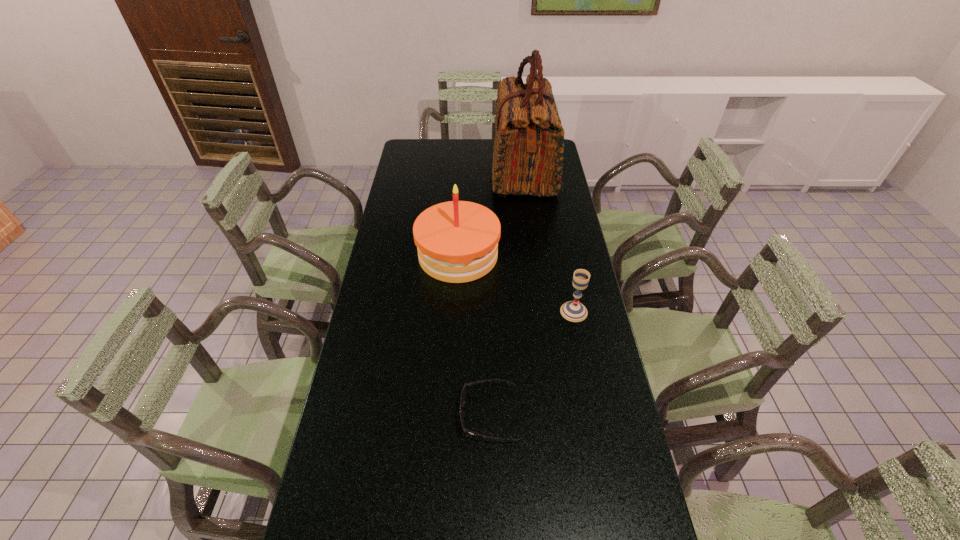
At what (x,y) coordinates should I click in order to perform the action: click on the farthest object. Please return your answer as a coordinate pair (x, y). The height and width of the screenshot is (540, 960). Looking at the image, I should click on (528, 148).

Where is `shopping bag`? The image size is (960, 540). shopping bag is located at coordinates (528, 148).

At what (x,y) coordinates should I click in order to perform the action: click on the second farthest object. Please return your answer as a coordinate pair (x, y). This screenshot has width=960, height=540. Looking at the image, I should click on (457, 241).

The height and width of the screenshot is (540, 960). Identify the location of birthday cake. (457, 241).

Where is `the third farthest object`? This screenshot has height=540, width=960. the third farthest object is located at coordinates (574, 311).

Where is `the third tallest object`? The height and width of the screenshot is (540, 960). the third tallest object is located at coordinates (574, 311).

What are the coordinates of `the shortest object` in the screenshot? It's located at (463, 394).

Identify the location of the nearest object. (463, 394).

The height and width of the screenshot is (540, 960). I want to click on free space located on the open handle side of the shopping bag, so click(x=441, y=171).

Identify the location of free region located on the open handle side of the shopping bag. This screenshot has height=540, width=960. (427, 171).